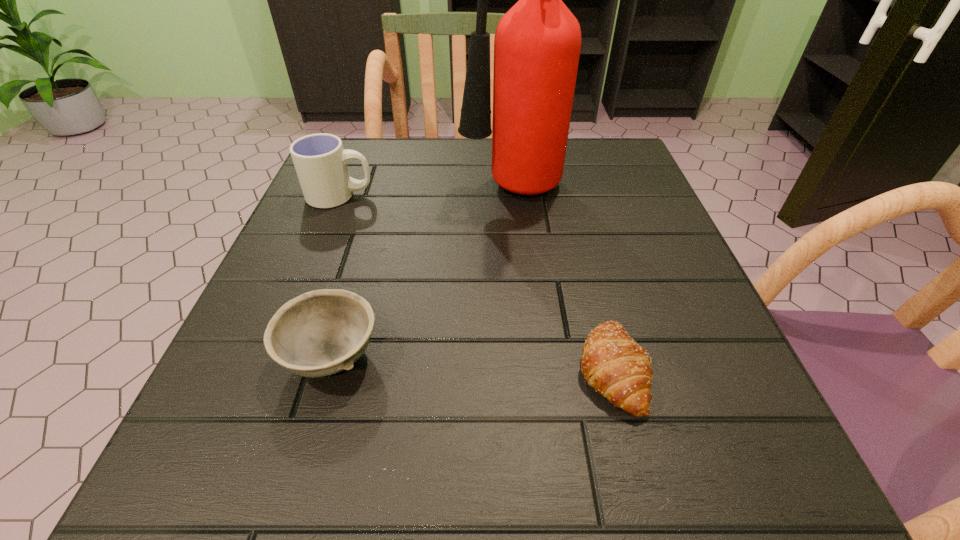
Where is `unoccupied position between the crescent roll and the cup`? This screenshot has width=960, height=540. unoccupied position between the crescent roll and the cup is located at coordinates (476, 282).

The width and height of the screenshot is (960, 540). Find the location of `free space between the second shortest object and the tallest object`. free space between the second shortest object and the tallest object is located at coordinates (x=421, y=274).

Locate an element on the screen. Image resolution: width=960 pixels, height=540 pixels. the third closest object relative to the bowl is located at coordinates (320, 161).

Locate which object is the second closest to the bowl. Please provide its 2D coordinates. Your answer should be formatted as a tuple, i.e. [(x, y)], where the tuple contains the x and y coordinates of a point satisfying the conditions above.

[(613, 364)]

Where is `vacant region that satisfies the following two spatial constraints: 1. with the handle on the side of the bowl; 2. on the right side of the cup`? The image size is (960, 540). vacant region that satisfies the following two spatial constraints: 1. with the handle on the side of the bowl; 2. on the right side of the cup is located at coordinates (276, 356).

Identify the location of vacant space that satisfies the following two spatial constraints: 1. with the handle on the side of the third shortest object; 2. on the left side of the crescent roll. (270, 369).

Where is `free space that satisfies the following two spatial constraints: 1. at the nozzle of the fire extinguisher; 2. on the left side of the shortest object`? This screenshot has width=960, height=540. free space that satisfies the following two spatial constraints: 1. at the nozzle of the fire extinguisher; 2. on the left side of the shortest object is located at coordinates (527, 369).

I want to click on free space that satisfies the following two spatial constraints: 1. with the handle on the side of the bowl; 2. on the left side of the cup, so click(276, 356).

This screenshot has width=960, height=540. What are the coordinates of `free space that satisfies the following two spatial constraints: 1. with the handle on the side of the cup; 2. on the back side of the second shortest object` in the screenshot? It's located at (276, 356).

Where is `free space that satisfies the following two spatial constraints: 1. with the handle on the side of the shortest object; 2. on the right side of the cup`? The width and height of the screenshot is (960, 540). free space that satisfies the following two spatial constraints: 1. with the handle on the side of the shortest object; 2. on the right side of the cup is located at coordinates point(270,369).